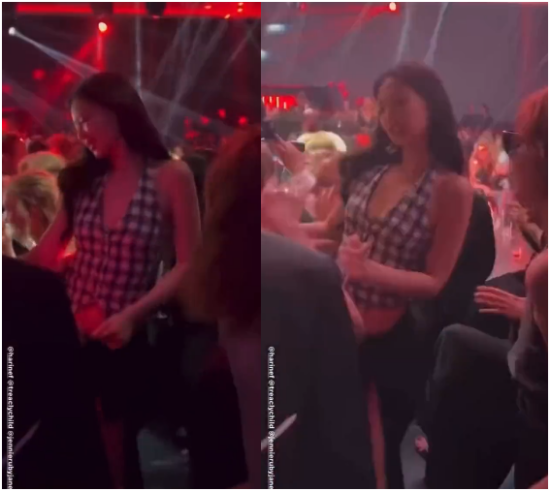
Locate an element on the screen. The width and height of the screenshot is (550, 491). leftmost spotlight in left photo is located at coordinates (12, 29).